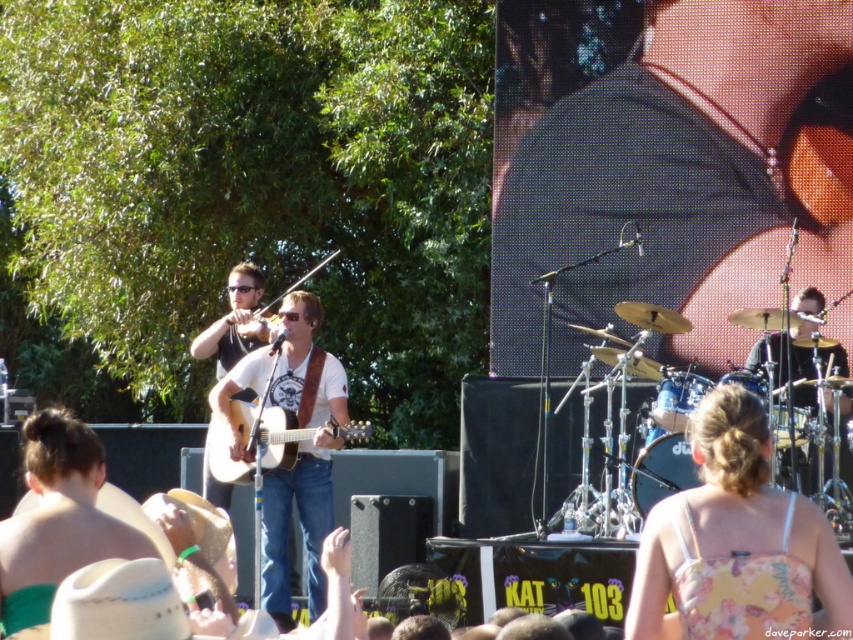
Which is more to the right, matte white guitar at center or black drum set at right?

From the viewer's perspective, black drum set at right appears more on the right side.

Which is above, matte white guitar at center or black drum set at right?

black drum set at right is higher up.

Is point (132, 545) farther from viewer compared to point (795, 336)?

No, (132, 545) is in front of (795, 336).

The width and height of the screenshot is (853, 640). Identify the location of matte white guitar at center. (57, 518).

Is floral fabric dress at lower right in front of matte white guitar at center?

No, floral fabric dress at lower right is behind matte white guitar at center.

Is floral fabric dress at lower right shorter than matte white guitar at center?

Incorrect, floral fabric dress at lower right's height does not fall short of matte white guitar at center's.

Between point (659, 598) and point (24, 582), which one is positioned in front?

Positioned in front is point (24, 582).

The height and width of the screenshot is (640, 853). Find the location of `floral fabric dress at lower right`. floral fabric dress at lower right is located at coordinates (735, 544).

Does matte black guitar at center have a lesser width compared to black drum set at right?

Indeed, matte black guitar at center has a lesser width compared to black drum set at right.

Is point (242, 276) more distant than point (816, 289)?

Yes, point (242, 276) is farther from viewer.

Where is `matte black guitar at center`? matte black guitar at center is located at coordinates (235, 321).

The height and width of the screenshot is (640, 853). In order to click on matte black guitar at center in this screenshot , I will do `click(235, 321)`.